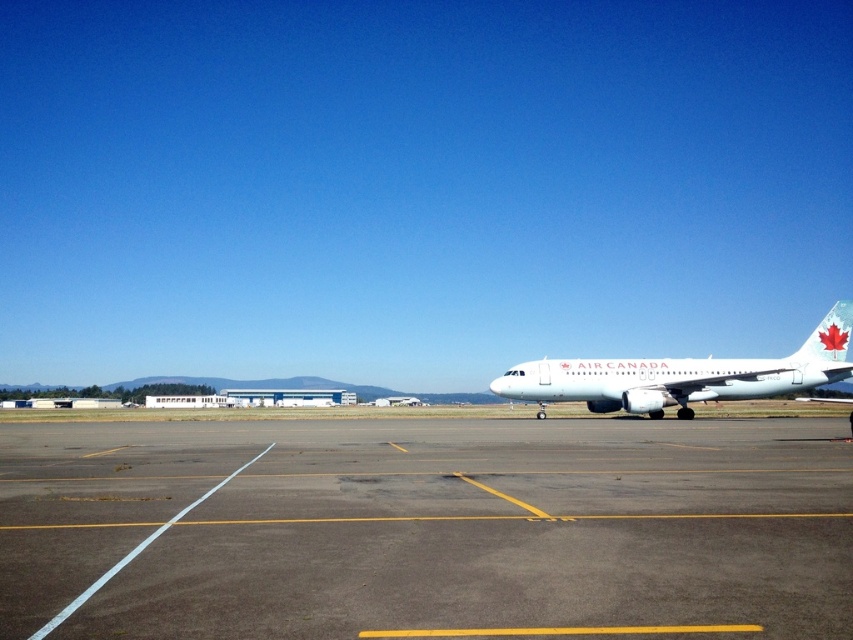
Question: Which of the following is the closest to the observer?

Choices:
 (A) (238, 572)
 (B) (827, 314)

Answer: (A)

Question: Can you confirm if gray asphalt tarmac at center is positioned above white glossy airplane at right?

Choices:
 (A) no
 (B) yes

Answer: (A)

Question: From the image, what is the correct spatial relationship of gray asphalt tarmac at center in relation to white glossy airplane at right?

Choices:
 (A) right
 (B) left

Answer: (B)

Question: Is gray asphalt tarmac at center further to camera compared to white glossy airplane at right?

Choices:
 (A) yes
 (B) no

Answer: (B)